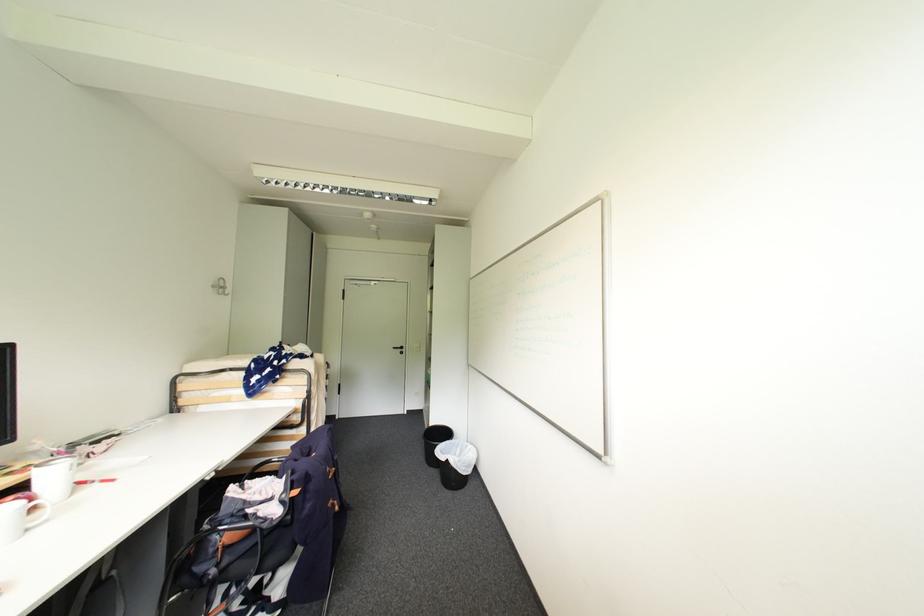
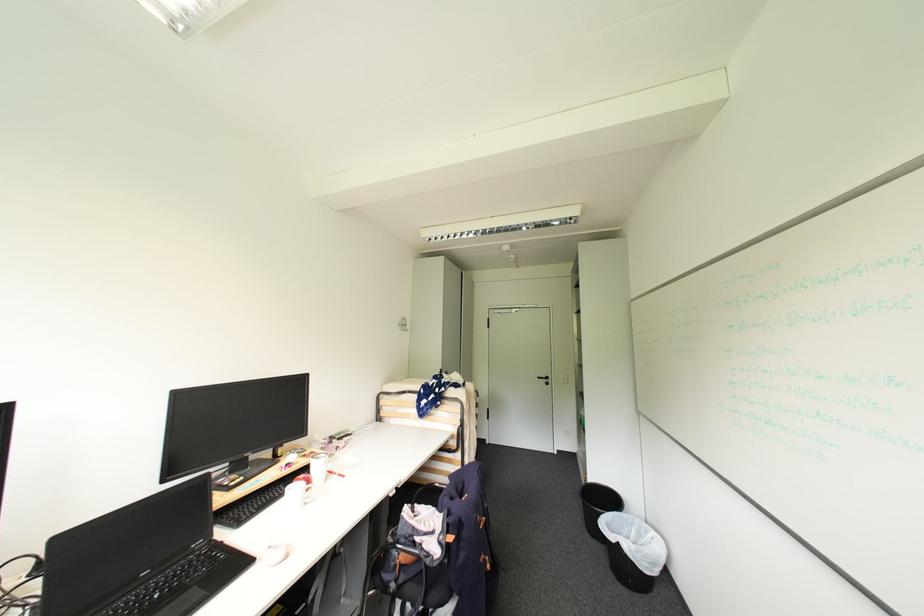
In the second image, find the point that corresponds to (x=220, y=286) in the first image.

(406, 325)